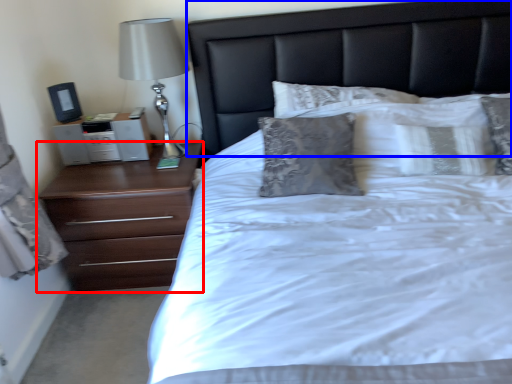
Question: Which object is further to the camera taking this photo, chest of drawers (highlighted by a red box) or headboard (highlighted by a blue box)?

Choices:
 (A) chest of drawers
 (B) headboard

Answer: (A)